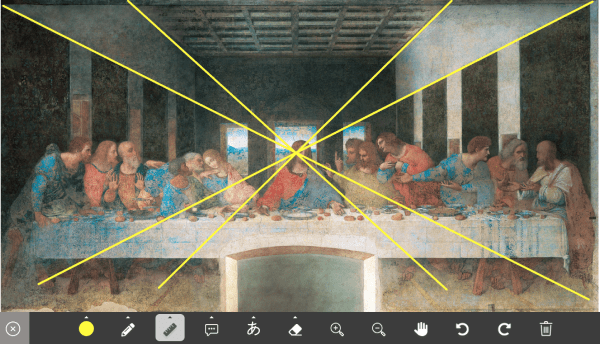
What are the coordinates of `table` in the screenshot? It's located at (171, 232), (214, 221), (258, 221), (336, 221), (379, 221), (423, 221), (489, 222), (116, 220).